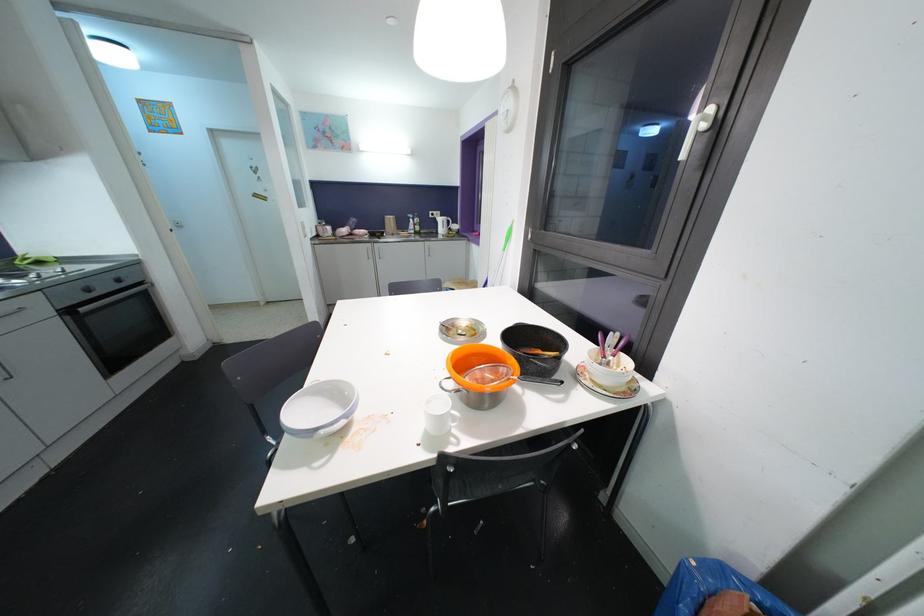
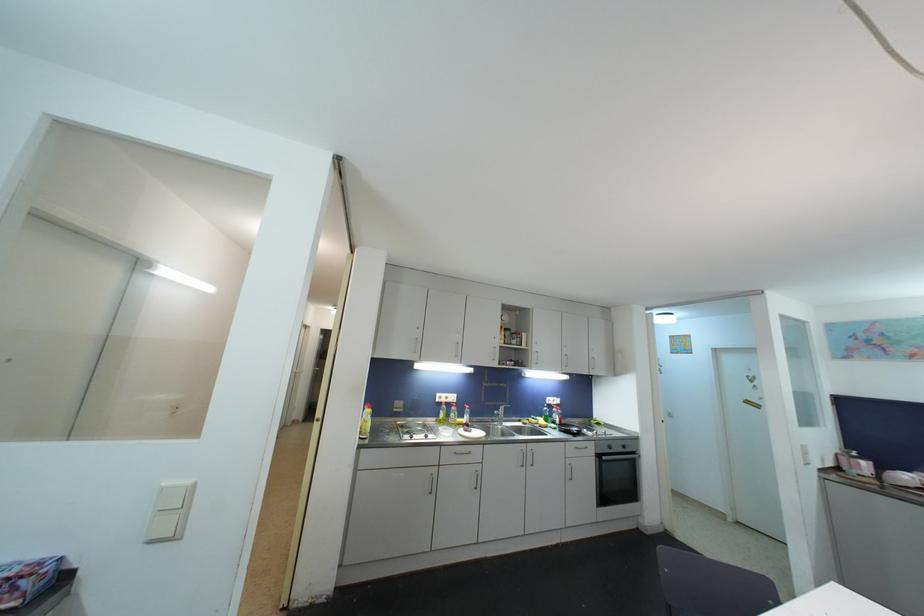
In the second image, find the point that corresponds to point (91, 293) in the first image.

(613, 450)